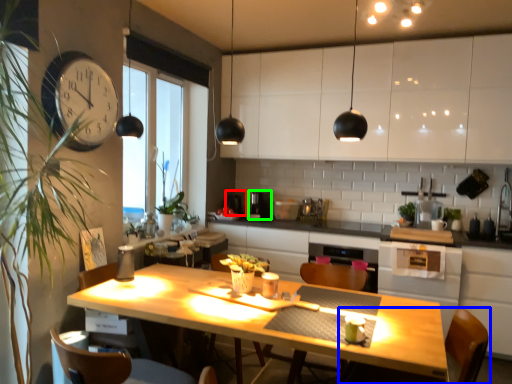
Question: Which object is the closest to the coffee machine (highlighted by a red box)? Choose among these: chair (highlighted by a blue box) or coffee machine (highlighted by a green box).

Choices:
 (A) chair
 (B) coffee machine

Answer: (B)